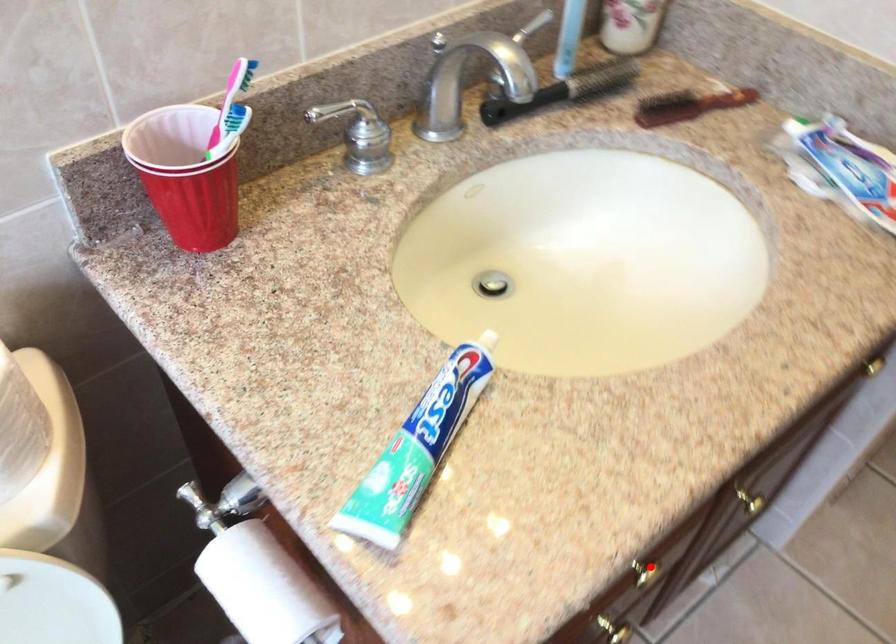
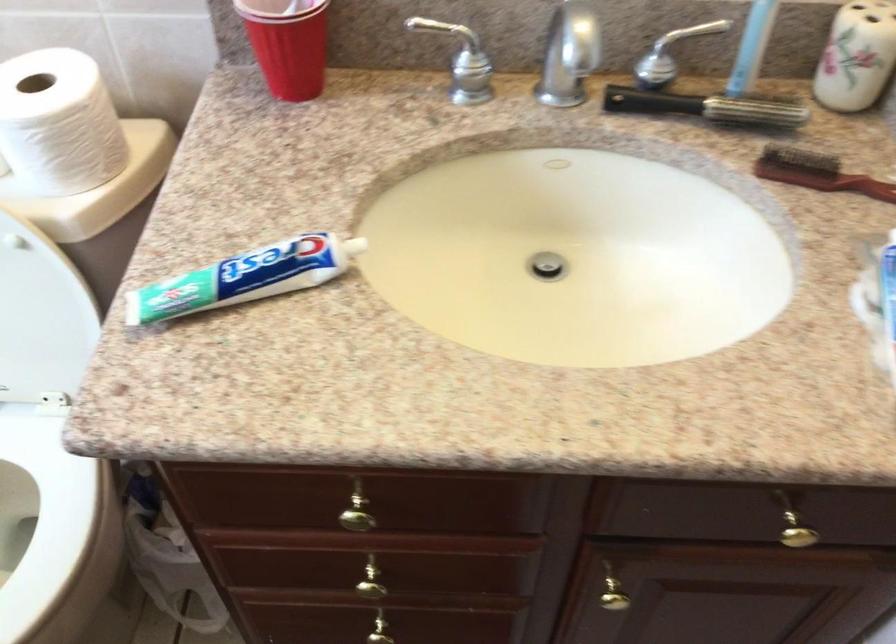
Question: I am providing you with two images of the same scene from different viewpoints. A red point is marked on the first image. At the location where the point appears in image 1, is it still visible in image 2?

Choices:
 (A) Yes
 (B) No

Answer: (A)